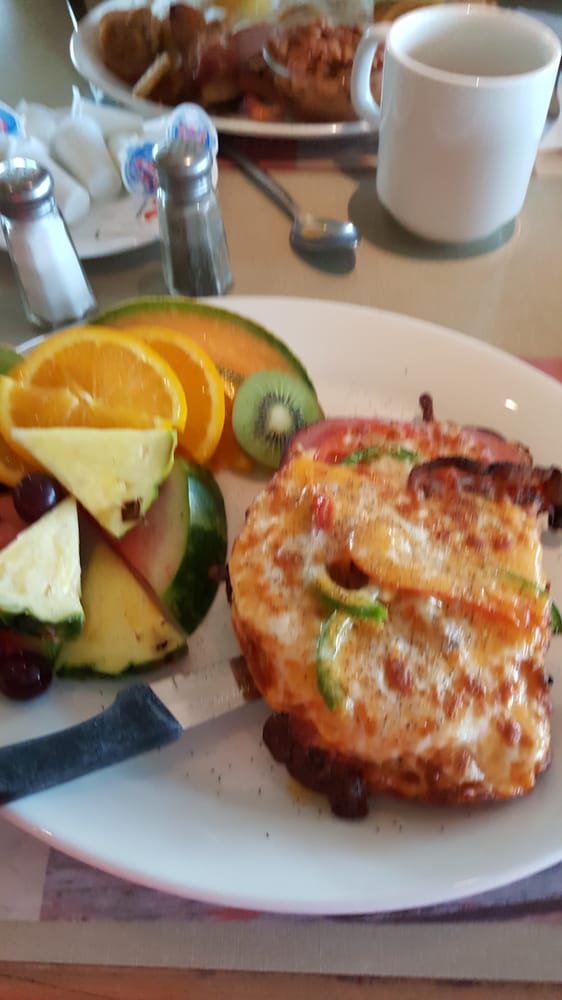
The width and height of the screenshot is (562, 1000). Identify the location of silverware. (116, 740), (323, 230).